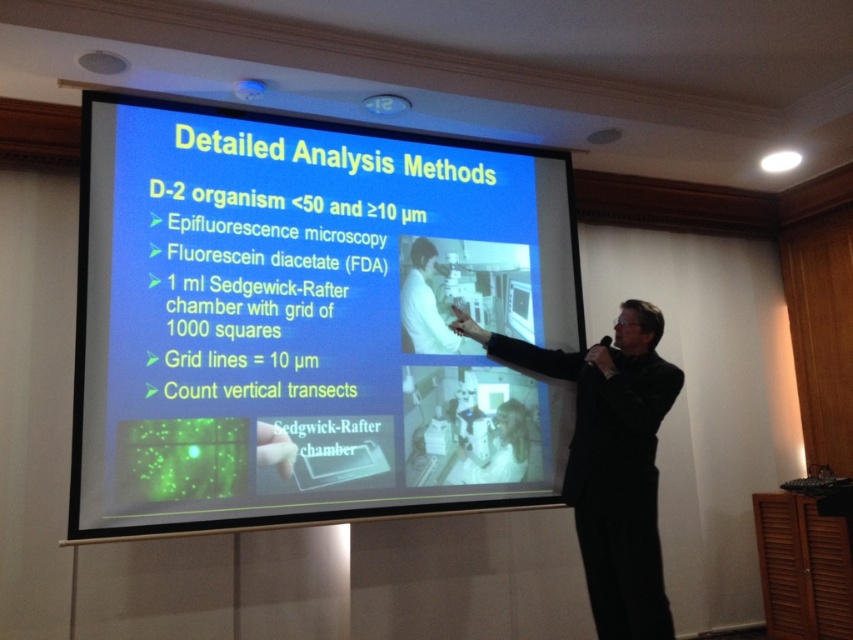
Does blue matte projector screen at center have a lesser height compared to white lab coat at center?

In fact, blue matte projector screen at center may be taller than white lab coat at center.

Is point (376, 424) in front of point (431, 346)?

Yes, it is in front of point (431, 346).

You are a GUI agent. You are given a task and a screenshot of the screen. Output one action in this format:
    pyautogui.click(x=<x>, y=<y>)
    Task: Click on the blue matte projector screen at center
    
    Given the screenshot: What is the action you would take?
    pyautogui.click(x=306, y=321)

The height and width of the screenshot is (640, 853). What are the coordinates of `blue matte projector screen at center` in the screenshot? It's located at (306, 321).

Does blue matte projector screen at center have a lesser height compared to black suit at center?

Incorrect, blue matte projector screen at center's height does not fall short of black suit at center's.

Which of these two, blue matte projector screen at center or black suit at center, stands shorter?

With less height is black suit at center.

This screenshot has width=853, height=640. Identify the location of blue matte projector screen at center. (306, 321).

Does black suit at center have a lesser height compared to white lab coat at center?

In fact, black suit at center may be taller than white lab coat at center.

Can you confirm if black suit at center is wider than white lab coat at center?

Indeed, black suit at center has a greater width compared to white lab coat at center.

This screenshot has height=640, width=853. Describe the element at coordinates (610, 461) in the screenshot. I see `black suit at center` at that location.

You are a GUI agent. You are given a task and a screenshot of the screen. Output one action in this format:
    pyautogui.click(x=<x>, y=<y>)
    Task: Click on the black suit at center
    Image resolution: width=853 pixels, height=640 pixels.
    Given the screenshot: What is the action you would take?
    pyautogui.click(x=610, y=461)